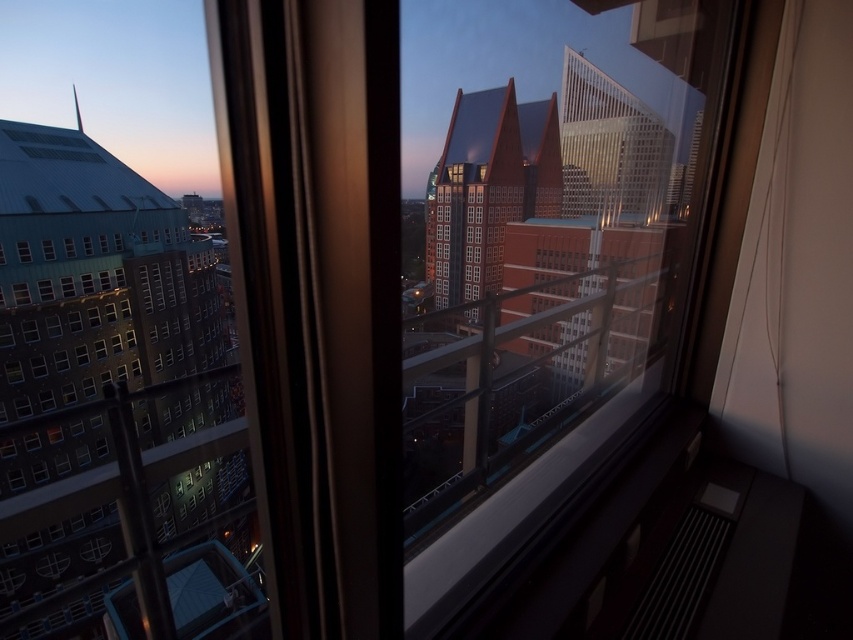
Does transparent glass window at lower left have a greater height compared to transparent glass window at center?

No.

Who is taller, transparent glass window at lower left or transparent glass window at center?

With more height is transparent glass window at center.

Who is more distant from viewer, [22,244] or [44,248]?

Positioned behind is point [44,248].

You are a GUI agent. You are given a task and a screenshot of the screen. Output one action in this format:
    pyautogui.click(x=<x>, y=<y>)
    Task: Click on the transparent glass window at lower left
    The image size is (853, 640).
    Given the screenshot: What is the action you would take?
    pyautogui.click(x=22, y=252)